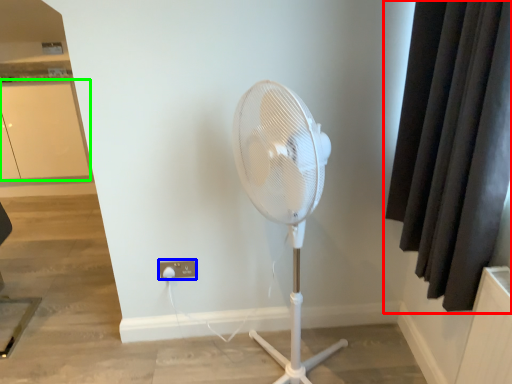
Question: Which object is positioned closest to curtain (highlighted by a red box)? Select from electric outlet (highlighted by a blue box) and screen door (highlighted by a green box).

Choices:
 (A) electric outlet
 (B) screen door

Answer: (A)